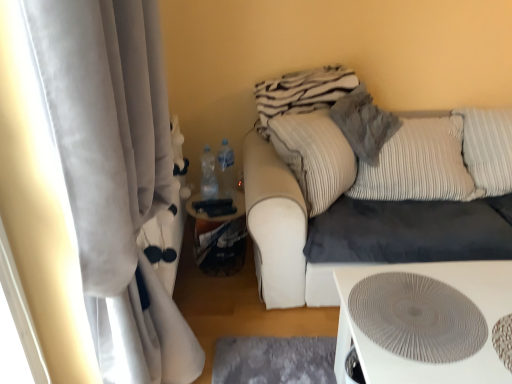
Locate an element on the screen. striped fabric pillow at upper right, the 1th pillow when ordered from right to left is located at coordinates (419, 165).

Identify the location of velvet beige couch at center. The image size is (512, 384). (367, 189).

What is the approximate width of white textured table at lower right?

21.09 inches.

This screenshot has width=512, height=384. I want to click on textured gray pillow at upper right, which is counted as the 2th pillow, starting from the right, so click(364, 123).

Where is `the 1st pillow above the white textured table at lower right (from the image's perspective)`? the 1st pillow above the white textured table at lower right (from the image's perspective) is located at coordinates [x=419, y=165].

Could you measure the distance between striped fabric pillow at upper right, the 1th pillow when ordered from right to left, and white textured table at lower right?

striped fabric pillow at upper right, the 1th pillow when ordered from right to left, is 29.33 inches from white textured table at lower right.

Considering the points (447, 192) and (390, 379), which point is in front, point (447, 192) or point (390, 379)?

The point (390, 379) is more forward.

How many degrees apart are the facing directions of striped fabric pillow at upper right, the 1th pillow when ordered from right to left, and white textured table at lower right?

striped fabric pillow at upper right, the 1th pillow when ordered from right to left, and white textured table at lower right are facing 1.16 degrees away from each other.

Which of these two, striped fabric pillow at upper right, the 1th pillow when ordered from right to left, or white velvet curtain at left, is bigger?

white velvet curtain at left is bigger.

From a real-world perspective, who is located higher, striped fabric pillow at upper right, acting as the second pillow starting from the left, or white velvet curtain at left?

white velvet curtain at left.

Consider the image. Do you think striped fabric pillow at upper right, acting as the second pillow starting from the left, is within white velvet curtain at left, or outside of it?

striped fabric pillow at upper right, acting as the second pillow starting from the left, exists outside the volume of white velvet curtain at left.

From the image's perspective, between striped fabric pillow at upper right, the 1th pillow when ordered from right to left, and white velvet curtain at left, who is located below?

white velvet curtain at left, from the image's perspective.

Is white velvet curtain at left wider or thinner than velvet beige couch at center?

In the image, white velvet curtain at left appears to be more narrow than velvet beige couch at center.

Is white velvet curtain at left oriented towards velvet beige couch at center?

No, white velvet curtain at left is not oriented towards velvet beige couch at center.

Is white velvet curtain at left directly adjacent to velvet beige couch at center?

No, white velvet curtain at left is not touching velvet beige couch at center.

From a real-world perspective, which is physically below, white velvet curtain at left or velvet beige couch at center?

velvet beige couch at center, from a real-world perspective.

Is velvet beige couch at center not within white textured table at lower right?

That's correct, velvet beige couch at center is outside of white textured table at lower right.

Is velvet beige couch at center bigger than white textured table at lower right?

Correct, velvet beige couch at center is larger in size than white textured table at lower right.

Is velvet beige couch at center facing away from white textured table at lower right?

No.

Would you consider velvet beige couch at center to be distant from white textured table at lower right?

No.

Is textured gray pillow at upper right, which is counted as the 2th pillow, starting from the right, at the back of velvet beige couch at center?

No.

Between velvet beige couch at center and textured gray pillow at upper right, which is counted as the 2th pillow, starting from the right, which one has larger width?

velvet beige couch at center is wider.

The height and width of the screenshot is (384, 512). I want to click on studio couch below the textured gray pillow at upper right, the first pillow from the left (from the image's perspective), so click(x=367, y=189).

From the image's perspective, which object appears higher, textured gray pillow at upper right, the first pillow from the left, or striped fabric pillow at upper right, acting as the second pillow starting from the left?

textured gray pillow at upper right, the first pillow from the left, appears higher in the image.

Between point (381, 121) and point (379, 156), which one is positioned in front?

Positioned in front is point (379, 156).

Image resolution: width=512 pixels, height=384 pixels. Identify the location of pillow above the striped fabric pillow at upper right, the 1th pillow when ordered from right to left (from a real-world perspective). (364, 123).

From the image's perspective, is textured gray pillow at upper right, which is counted as the 2th pillow, starting from the right, located beneath velvet beige couch at center?

No, from the image's perspective, textured gray pillow at upper right, which is counted as the 2th pillow, starting from the right, is not beneath velvet beige couch at center.

Is textured gray pillow at upper right, the first pillow from the left, outside of velvet beige couch at center?

That's incorrect, textured gray pillow at upper right, the first pillow from the left, is not completely outside velvet beige couch at center.

Is textured gray pillow at upper right, the first pillow from the left, positioned far away from velvet beige couch at center?

No, textured gray pillow at upper right, the first pillow from the left, is not far from velvet beige couch at center.

Considering the sizes of objects textured gray pillow at upper right, which is counted as the 2th pillow, starting from the right, and velvet beige couch at center in the image provided, who is thinner, textured gray pillow at upper right, which is counted as the 2th pillow, starting from the right, or velvet beige couch at center?

Thinner between the two is textured gray pillow at upper right, which is counted as the 2th pillow, starting from the right.

Locate an element on the screen. Image resolution: width=512 pixels, height=384 pixels. pillow that appears on the right of white textured table at lower right is located at coordinates (419, 165).

Find the location of `the 2nd pillow behind when counting from the white velvet curtain at left`. the 2nd pillow behind when counting from the white velvet curtain at left is located at coordinates (419, 165).

From the image, which object appears to be nearer to white velvet curtain at left, velvet beige couch at center or textured gray pillow at upper right, which is counted as the 2th pillow, starting from the right?

velvet beige couch at center is positioned closer to the anchor white velvet curtain at left.

Which object lies nearer to the anchor point striped fabric pillow at upper right, acting as the second pillow starting from the left, velvet beige couch at center or white velvet curtain at left?

velvet beige couch at center lies closer to striped fabric pillow at upper right, acting as the second pillow starting from the left, than the other object.

Considering their positions, is velvet beige couch at center positioned closer to textured gray pillow at upper right, the first pillow from the left, than white velvet curtain at left?

Among the two, velvet beige couch at center is located nearer to textured gray pillow at upper right, the first pillow from the left.

In the scene shown: Which object lies further to the anchor point white velvet curtain at left, striped fabric pillow at upper right, the 1th pillow when ordered from right to left, or textured gray pillow at upper right, the first pillow from the left?

striped fabric pillow at upper right, the 1th pillow when ordered from right to left, is positioned further to the anchor white velvet curtain at left.

In the scene shown: Considering their positions, is white velvet curtain at left positioned closer to white textured table at lower right than velvet beige couch at center?

velvet beige couch at center is closer to white textured table at lower right.

Which object lies nearer to the anchor point white textured table at lower right, white velvet curtain at left or textured gray pillow at upper right, which is counted as the 2th pillow, starting from the right?

The object closer to white textured table at lower right is white velvet curtain at left.

From the image, which object appears to be nearer to striped fabric pillow at upper right, acting as the second pillow starting from the left, textured gray pillow at upper right, the first pillow from the left, or white textured table at lower right?

Among the two, textured gray pillow at upper right, the first pillow from the left, is located nearer to striped fabric pillow at upper right, acting as the second pillow starting from the left.

Estimate the real-world distances between objects in this image. Which object is further from velvet beige couch at center, white velvet curtain at left or white textured table at lower right?

Among the two, white velvet curtain at left is located further to velvet beige couch at center.

Where is `studio couch between white velvet curtain at left and striped fabric pillow at upper right, acting as the second pillow starting from the left, along the z-axis`? studio couch between white velvet curtain at left and striped fabric pillow at upper right, acting as the second pillow starting from the left, along the z-axis is located at coordinates (367, 189).

Where is `table located between white velvet curtain at left and textured gray pillow at upper right, which is counted as the 2th pillow, starting from the right, in the depth direction`? The image size is (512, 384). table located between white velvet curtain at left and textured gray pillow at upper right, which is counted as the 2th pillow, starting from the right, in the depth direction is located at coordinates (425, 363).

The width and height of the screenshot is (512, 384). Identify the location of studio couch between white velvet curtain at left and textured gray pillow at upper right, the first pillow from the left, along the z-axis. (367, 189).

This screenshot has height=384, width=512. I want to click on pillow between textured gray pillow at upper right, which is counted as the 2th pillow, starting from the right, and white textured table at lower right vertically, so click(419, 165).